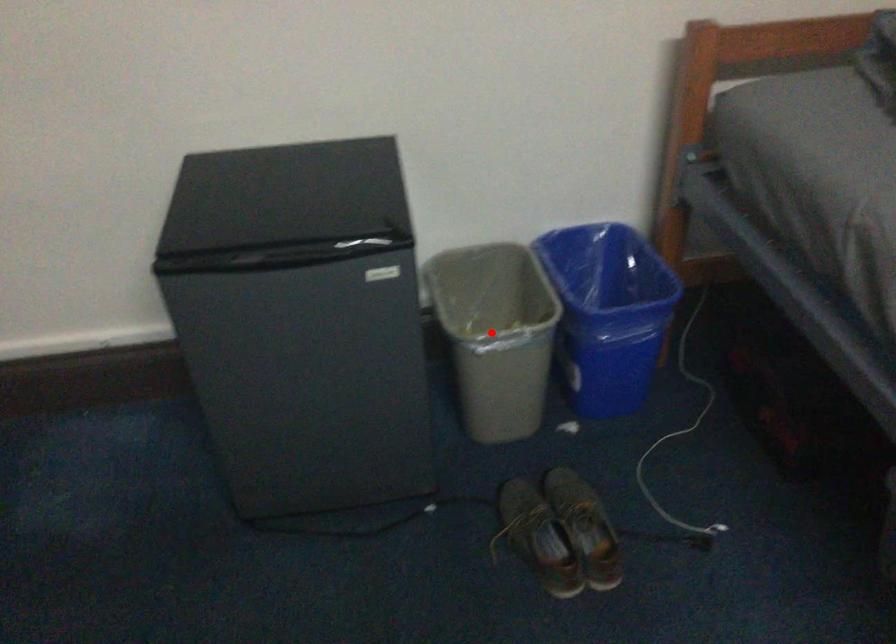
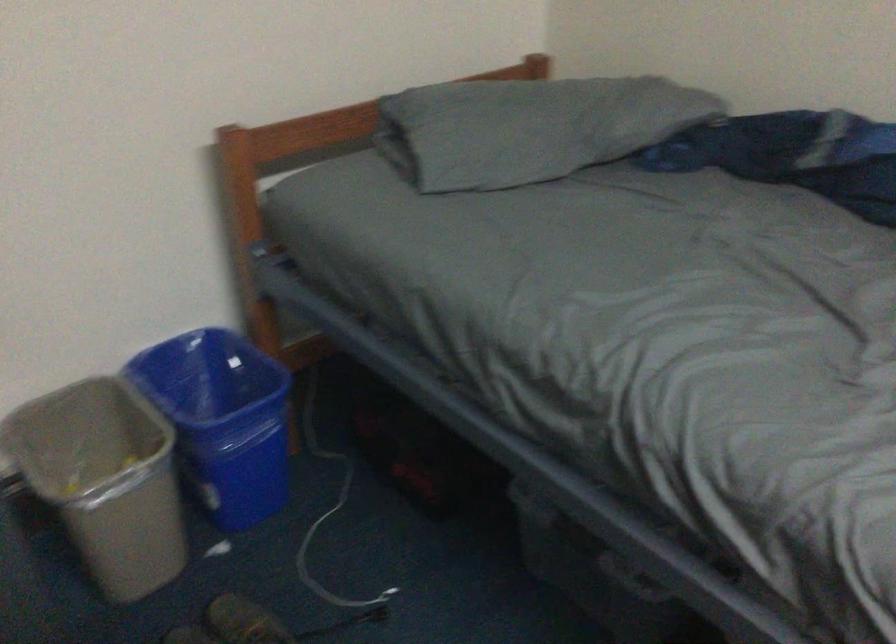
Question: I am providing you with two images of the same scene from different viewpoints. A red point is marked on the first image. Can you still see the location of the red point in image 2?

Choices:
 (A) Yes
 (B) No

Answer: (A)